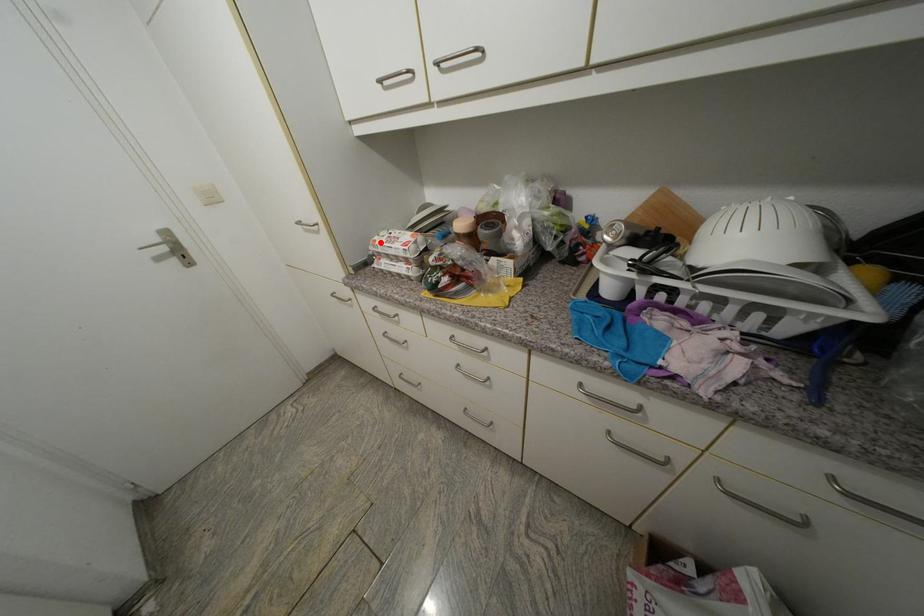
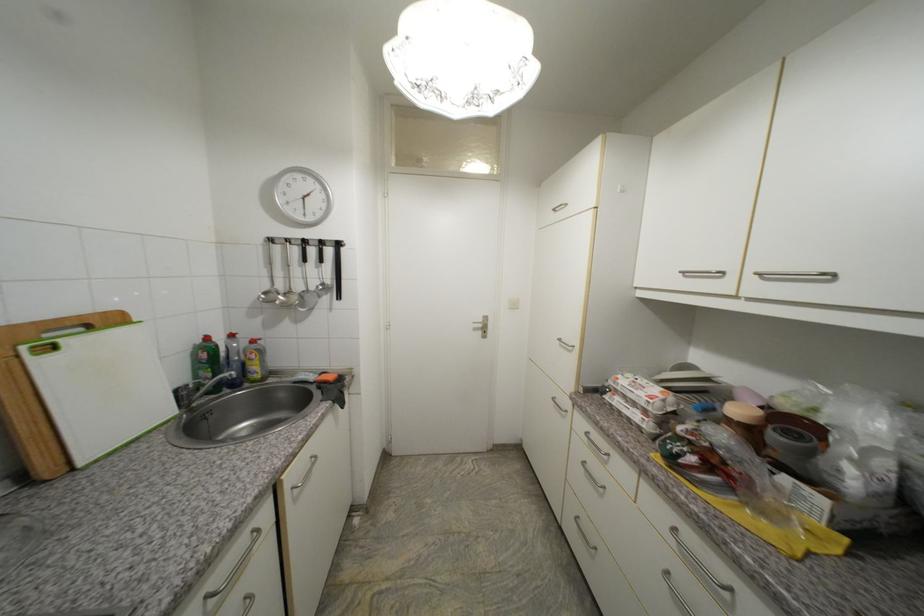
Find the pixel in the second image that matches the highlighted location in the first image.

(623, 379)